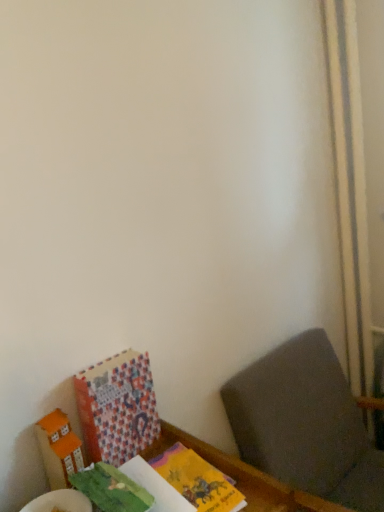
The height and width of the screenshot is (512, 384). Describe the element at coordinates (117, 407) in the screenshot. I see `patterned paper book at lower left` at that location.

Locate an element on the screen. orange matte cardboard box at lower left is located at coordinates click(59, 449).

Looking at this image, does patterned paper book at lower left have a greater height compared to wooden table at lower left?

Yes.

From the image's perspective, is patterned paper book at lower left on top of wooden table at lower left?

Yes, from the image's perspective, patterned paper book at lower left is on top of wooden table at lower left.

Based on the photo, can you confirm if patterned paper book at lower left is bigger than wooden table at lower left?

No.

From a real-world perspective, is patterned paper book at lower left under wooden table at lower left?

No, from a real-world perspective, patterned paper book at lower left is not below wooden table at lower left.

Image resolution: width=384 pixels, height=512 pixels. What are the coordinates of `book on the right of orange matte cardboard box at lower left` in the screenshot? It's located at (117, 407).

How different are the orientations of patterned paper book at lower left and orange matte cardboard box at lower left in degrees?

There is a 0.00137-degree angle between the facing directions of patterned paper book at lower left and orange matte cardboard box at lower left.

Is patterned paper book at lower left positioned far away from orange matte cardboard box at lower left?

No, patterned paper book at lower left is not far away from orange matte cardboard box at lower left.

Looking at this image, looking at their sizes, would you say dark gray fabric at lower right is wider or thinner than patterned paper book at lower left?

dark gray fabric at lower right is wider than patterned paper book at lower left.

Does dark gray fabric at lower right have a greater height compared to patterned paper book at lower left?

Correct, dark gray fabric at lower right is much taller as patterned paper book at lower left.

Considering their positions, is dark gray fabric at lower right located in front of or behind patterned paper book at lower left?

Visually, dark gray fabric at lower right is located in front of patterned paper book at lower left.

Is point (294, 418) positioned before point (117, 399)?

No, (294, 418) is further to viewer.

From the image's perspective, is orange matte cardboard box at lower left positioned above or below wooden table at lower left?

orange matte cardboard box at lower left is situated higher than wooden table at lower left in the image.

Considering the relative sizes of orange matte cardboard box at lower left and wooden table at lower left in the image provided, is orange matte cardboard box at lower left shorter than wooden table at lower left?

In fact, orange matte cardboard box at lower left may be taller than wooden table at lower left.

Measure the distance from orange matte cardboard box at lower left to wooden table at lower left.

orange matte cardboard box at lower left is 12.38 inches away from wooden table at lower left.

Identify the location of furniture in front of the orange matte cardboard box at lower left. (305, 424).

From the image's perspective, which object appears higher, dark gray fabric at lower right or orange matte cardboard box at lower left?

orange matte cardboard box at lower left is shown above in the image.

Is dark gray fabric at lower right next to orange matte cardboard box at lower left and touching it?

No, dark gray fabric at lower right is not beside orange matte cardboard box at lower left.

Considering the sizes of objects wooden table at lower left and patterned paper book at lower left in the image provided, who is taller, wooden table at lower left or patterned paper book at lower left?

patterned paper book at lower left.

Image resolution: width=384 pixels, height=512 pixels. Identify the location of table in front of the patterned paper book at lower left. (246, 477).

From a real-world perspective, is wooden table at lower left positioned under patterned paper book at lower left based on gravity?

Indeed, from a real-world perspective, wooden table at lower left is positioned beneath patterned paper book at lower left.

Is patterned paper book at lower left placed right next to dark gray fabric at lower right?

No, patterned paper book at lower left is not making contact with dark gray fabric at lower right.

Looking at this image, considering their positions, is patterned paper book at lower left located in front of or behind dark gray fabric at lower right?

Clearly, patterned paper book at lower left is behind dark gray fabric at lower right.

Is patterned paper book at lower left inside or outside of dark gray fabric at lower right?

patterned paper book at lower left is outside dark gray fabric at lower right.

Is patterned paper book at lower left oriented away from dark gray fabric at lower right?

That's not correct — patterned paper book at lower left is not looking away from dark gray fabric at lower right.

At what (x,y) coordinates should I click in order to perform the action: click on book on the left side of wooden table at lower left. Please return your answer as a coordinate pair (x, y). Image resolution: width=384 pixels, height=512 pixels. Looking at the image, I should click on coord(117,407).

Identify the location of book behind the orange matte cardboard box at lower left. This screenshot has height=512, width=384. (117, 407).

Looking at this image, based on their spatial positions, is patterned paper book at lower left or orange matte cardboard box at lower left closer to dark gray fabric at lower right?

patterned paper book at lower left.

From the image, which object appears to be nearer to dark gray fabric at lower right, wooden table at lower left or orange matte cardboard box at lower left?

Based on the image, wooden table at lower left appears to be nearer to dark gray fabric at lower right.

Considering their positions, is patterned paper book at lower left positioned closer to dark gray fabric at lower right than wooden table at lower left?

The object closer to dark gray fabric at lower right is wooden table at lower left.

Considering their positions, is orange matte cardboard box at lower left positioned further to dark gray fabric at lower right than patterned paper book at lower left?

orange matte cardboard box at lower left is further to dark gray fabric at lower right.

Looking at the image, which one is located further to orange matte cardboard box at lower left, wooden table at lower left or dark gray fabric at lower right?

dark gray fabric at lower right is further to orange matte cardboard box at lower left.

From the image, which object appears to be nearer to orange matte cardboard box at lower left, patterned paper book at lower left or wooden table at lower left?

The object closer to orange matte cardboard box at lower left is patterned paper book at lower left.

From the image, which object appears to be farther from wooden table at lower left, patterned paper book at lower left or orange matte cardboard box at lower left?

Based on the image, orange matte cardboard box at lower left appears to be further to wooden table at lower left.

From the image, which object appears to be nearer to wooden table at lower left, patterned paper book at lower left or dark gray fabric at lower right?

The object closer to wooden table at lower left is patterned paper book at lower left.

Locate an element on the screen. Image resolution: width=384 pixels, height=512 pixels. book between orange matte cardboard box at lower left and dark gray fabric at lower right from left to right is located at coordinates (117, 407).

The width and height of the screenshot is (384, 512). What are the coordinates of `table situated between patterned paper book at lower left and dark gray fabric at lower right from left to right` in the screenshot? It's located at (246, 477).

Locate an element on the screen. table between orange matte cardboard box at lower left and dark gray fabric at lower right is located at coordinates (246, 477).

Find the location of `cardboard box between wooden table at lower left and patterned paper book at lower left in the front-back direction`. cardboard box between wooden table at lower left and patterned paper book at lower left in the front-back direction is located at coordinates (59, 449).